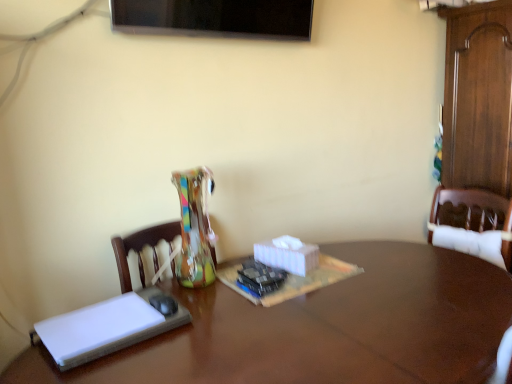
Where is `vacant space to the right of white matte book at left`? vacant space to the right of white matte book at left is located at coordinates (213, 332).